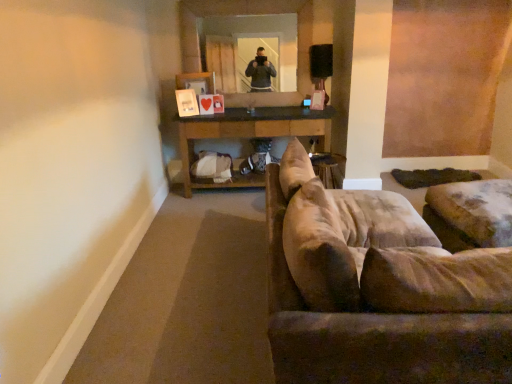
Question: Is brown wooden table at center next to clear glass mirror at upper center and touching it?

Choices:
 (A) yes
 (B) no

Answer: (B)

Question: From the image's perspective, does brown wooden table at center appear lower than clear glass mirror at upper center?

Choices:
 (A) no
 (B) yes

Answer: (B)

Question: Does brown wooden table at center have a smaller size compared to clear glass mirror at upper center?

Choices:
 (A) no
 (B) yes

Answer: (A)

Question: Does brown wooden table at center have a lesser height compared to clear glass mirror at upper center?

Choices:
 (A) yes
 (B) no

Answer: (A)

Question: Is brown wooden table at center thinner than clear glass mirror at upper center?

Choices:
 (A) no
 (B) yes

Answer: (A)

Question: Considering the positions of point (227, 185) and point (278, 23), is point (227, 185) closer or farther from the camera than point (278, 23)?

Choices:
 (A) closer
 (B) farther

Answer: (B)

Question: Is brown wooden table at center inside the boundaries of clear glass mirror at upper center, or outside?

Choices:
 (A) outside
 (B) inside

Answer: (A)

Question: Is brown wooden table at center in front of or behind clear glass mirror at upper center in the image?

Choices:
 (A) front
 (B) behind

Answer: (A)

Question: From a real-world perspective, is brown wooden table at center above or below clear glass mirror at upper center?

Choices:
 (A) above
 (B) below

Answer: (B)

Question: Relative to suede-like beige couch at right, is brown wooden table at center in front or behind?

Choices:
 (A) behind
 (B) front

Answer: (A)

Question: Which is correct: brown wooden table at center is inside suede-like beige couch at right, or outside of it?

Choices:
 (A) outside
 (B) inside

Answer: (A)

Question: Visually, is brown wooden table at center positioned to the left or to the right of suede-like beige couch at right?

Choices:
 (A) right
 (B) left

Answer: (B)

Question: In terms of height, does brown wooden table at center look taller or shorter compared to suede-like beige couch at right?

Choices:
 (A) tall
 (B) short

Answer: (B)

Question: Is clear glass mirror at upper center wider or thinner than suede-like beige couch at right?

Choices:
 (A) wide
 (B) thin

Answer: (B)

Question: Is clear glass mirror at upper center taller or shorter than suede-like beige couch at right?

Choices:
 (A) short
 (B) tall

Answer: (B)